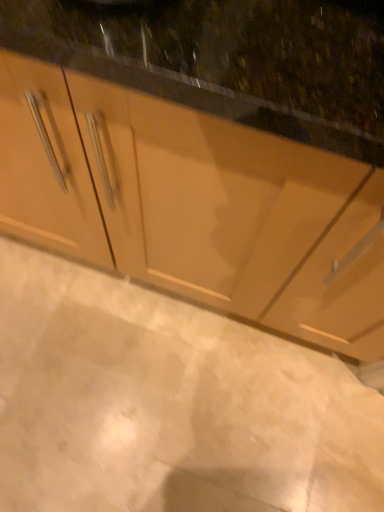
Question: From the image's perspective, is white marble floor at lower center above or below matte wood cabinet at center?

Choices:
 (A) below
 (B) above

Answer: (A)

Question: Is white marble floor at lower center spatially inside matte wood cabinet at center, or outside of it?

Choices:
 (A) inside
 (B) outside

Answer: (B)

Question: From their relative heights in the image, would you say white marble floor at lower center is taller or shorter than matte wood cabinet at center?

Choices:
 (A) tall
 (B) short

Answer: (B)

Question: Would you say matte wood cabinet at center is inside or outside white marble floor at lower center?

Choices:
 (A) inside
 (B) outside

Answer: (B)

Question: From a real-world perspective, is matte wood cabinet at center above or below white marble floor at lower center?

Choices:
 (A) below
 (B) above

Answer: (B)

Question: In terms of height, does matte wood cabinet at center look taller or shorter compared to white marble floor at lower center?

Choices:
 (A) short
 (B) tall

Answer: (B)

Question: Is point (269, 273) positioned closer to the camera than point (190, 461)?

Choices:
 (A) closer
 (B) farther

Answer: (A)